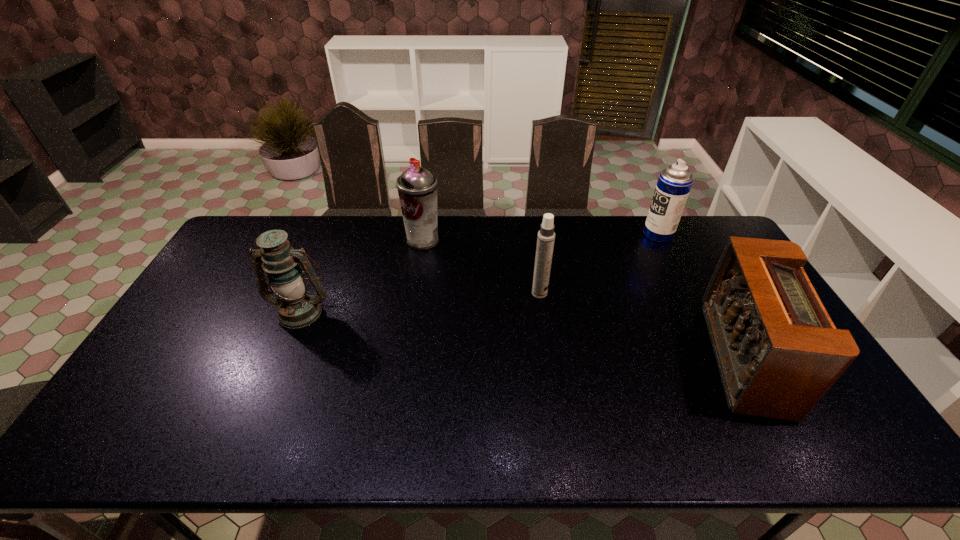
At what (x,y) coordinates should I click in order to perform the action: click on free space located 0.220m on the left of the leftmost object. Please return your answer as a coordinate pair (x, y). The height and width of the screenshot is (540, 960). Looking at the image, I should click on (196, 311).

What are the coordinates of `vacant space located on the back of the nearest aerosol can` in the screenshot? It's located at (532, 242).

Where is `vacant space situated 0.120m on the back of the radio receiver`? vacant space situated 0.120m on the back of the radio receiver is located at coordinates (700, 278).

At what (x,y) coordinates should I click in order to perform the action: click on object that is positioned at the near edge. Please return your answer as a coordinate pair (x, y). This screenshot has height=540, width=960. Looking at the image, I should click on (778, 352).

Find the location of `object present at the right edge`. object present at the right edge is located at coordinates (778, 352).

At what (x,y) coordinates should I click in order to perform the action: click on object at the near right corner. Please return your answer as a coordinate pair (x, y). The image size is (960, 540). Looking at the image, I should click on (778, 352).

Locate an element on the screen. The image size is (960, 540). vacant region at the far edge of the desktop is located at coordinates (365, 230).

In the image, there is a desktop. Where is `vacant space at the near edge`? This screenshot has height=540, width=960. vacant space at the near edge is located at coordinates (337, 455).

You are a GUI agent. You are given a task and a screenshot of the screen. Output one action in this format:
    pyautogui.click(x=<x>, y=<y>)
    Task: Click on the vacant space at the right edge of the desktop
    This screenshot has width=960, height=540.
    Given the screenshot: What is the action you would take?
    pyautogui.click(x=846, y=415)

In the image, there is a desktop. In order to click on vacant region at the far right corner in this screenshot , I will do `click(691, 253)`.